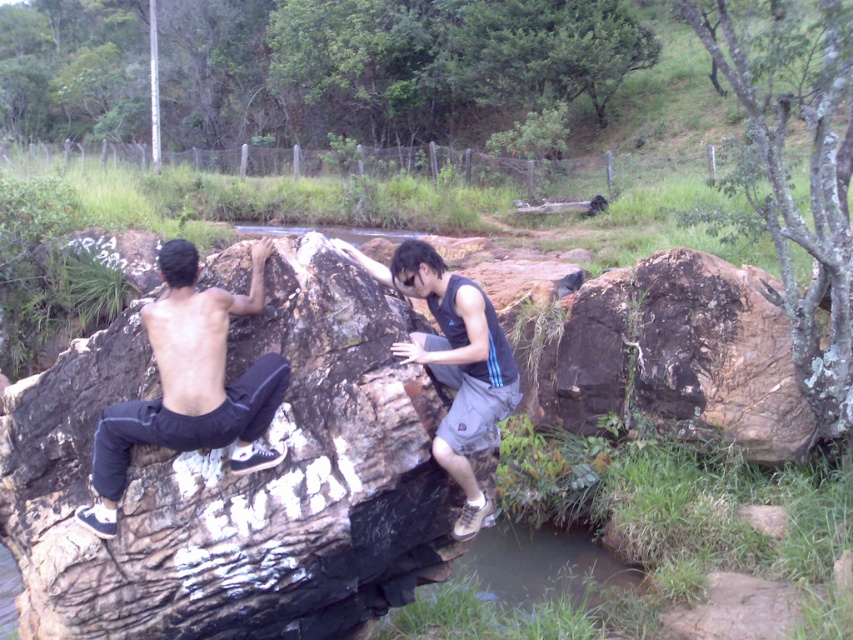
Question: Which point appears closest to the camera in this image?

Choices:
 (A) (776, 404)
 (B) (354, 307)

Answer: (B)

Question: Which object is positioned farthest from the dark blue sleeveless shirt at center?

Choices:
 (A) rough textured rock at center
 (B) black matte pants at left
 (C) brown rough rock at right

Answer: (C)

Question: Is rough textured rock at center in front of dark blue sleeveless shirt at center?

Choices:
 (A) yes
 (B) no

Answer: (A)

Question: Is black matte pants at left smaller than dark blue sleeveless shirt at center?

Choices:
 (A) yes
 (B) no

Answer: (A)

Question: Is black matte pants at left to the right of dark blue sleeveless shirt at center from the viewer's perspective?

Choices:
 (A) yes
 (B) no

Answer: (B)

Question: Which point is farther to the camera?

Choices:
 (A) (637, 368)
 (B) (463, 467)
 (C) (105, 612)
 (D) (286, 387)

Answer: (A)